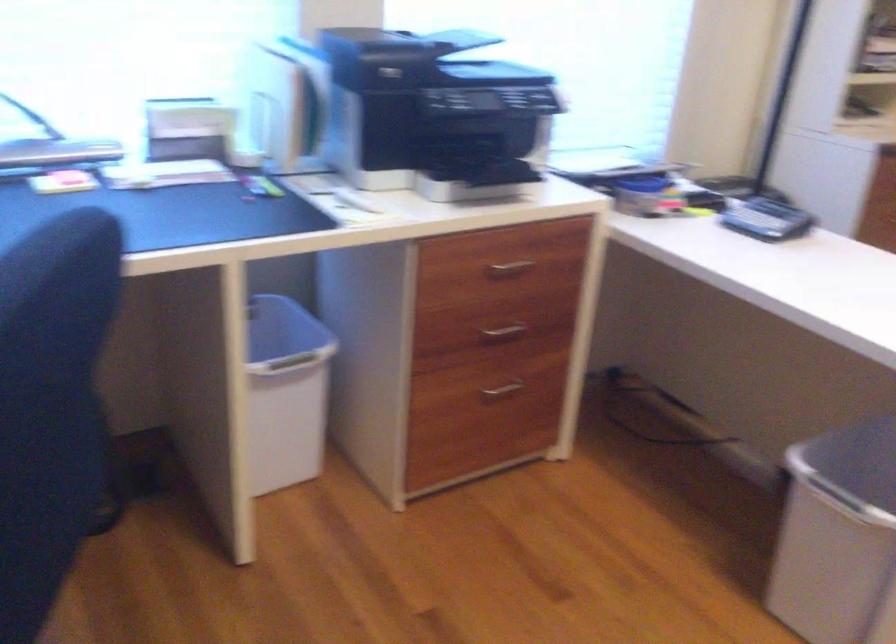
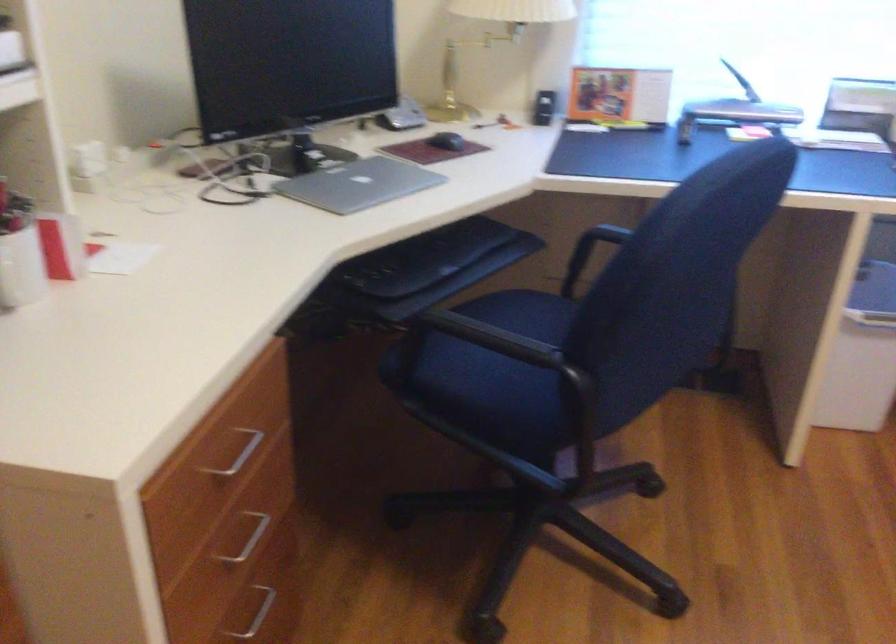
The point at (279, 409) is marked in the first image. Where is the corresponding point in the second image?

(862, 355)